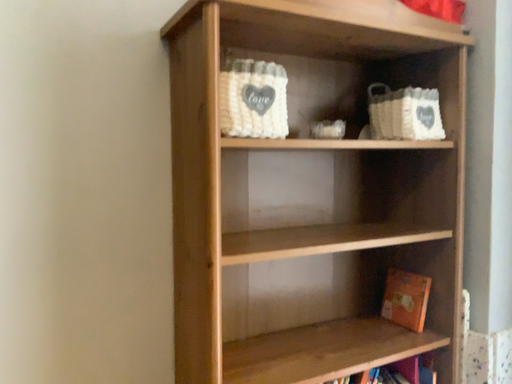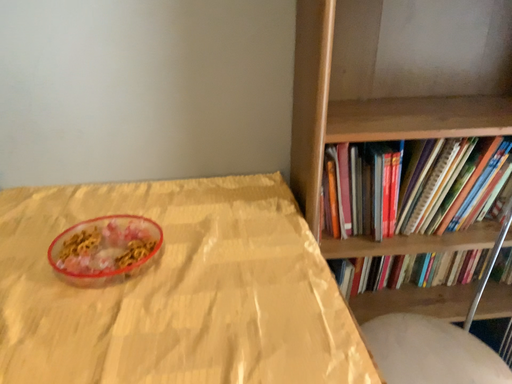
Question: Which way did the camera rotate in the video?

Choices:
 (A) rotated downward
 (B) rotated upward

Answer: (A)